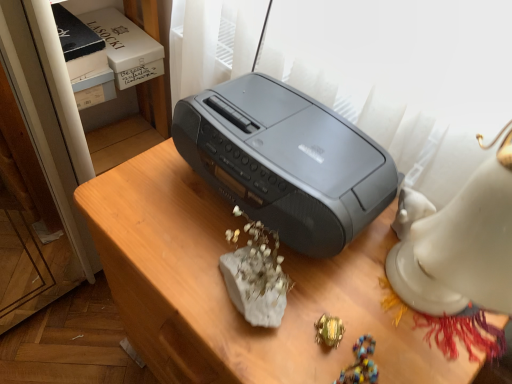
You are a GUI agent. You are given a task and a screenshot of the screen. Output one action in this format:
    pyautogui.click(x=<x>, y=<y>)
    Task: Click on the blank space above slate gray plastic printer at center (from a real-world perspective)
    
    Given the screenshot: What is the action you would take?
    pyautogui.click(x=280, y=127)